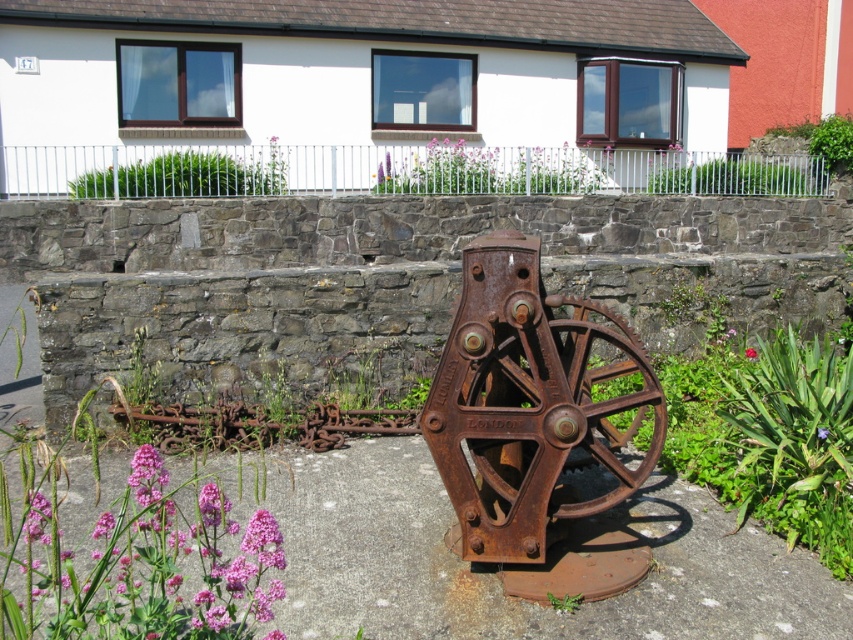
Question: Among these points, which one is farthest from the camera?

Choices:
 (A) (572, 516)
 (B) (96, 538)
 (C) (821, 428)

Answer: (C)

Question: Observing the image, what is the correct spatial positioning of purple soft flower at center in reference to pink matte flower at center?

Choices:
 (A) above
 (B) below

Answer: (B)

Question: Can you confirm if pink matte flowers at lower left is positioned below rusty metal gear at center?

Choices:
 (A) yes
 (B) no

Answer: (A)

Question: Which object is positioned farthest from the purple soft flower at center?

Choices:
 (A) pink matte flowers at lower left
 (B) pink matte flower at center
 (C) purple matte flower at lower left
 (D) rusty metal gear at center

Answer: (C)

Question: Can you confirm if rusty metal gear at center is wider than pink matte flower at lower left?

Choices:
 (A) no
 (B) yes

Answer: (B)

Question: Which of these objects is positioned farthest from the rusty metal gear at center?

Choices:
 (A) pink matte flowers at lower left
 (B) purple matte flower at lower left
 (C) pink matte flower at lower left
 (D) purple soft flower at center

Answer: (C)